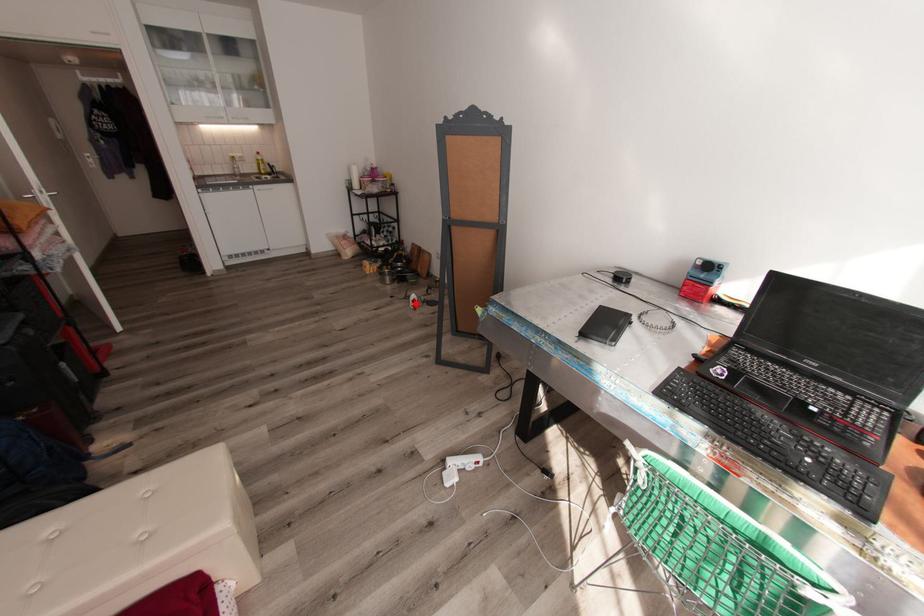
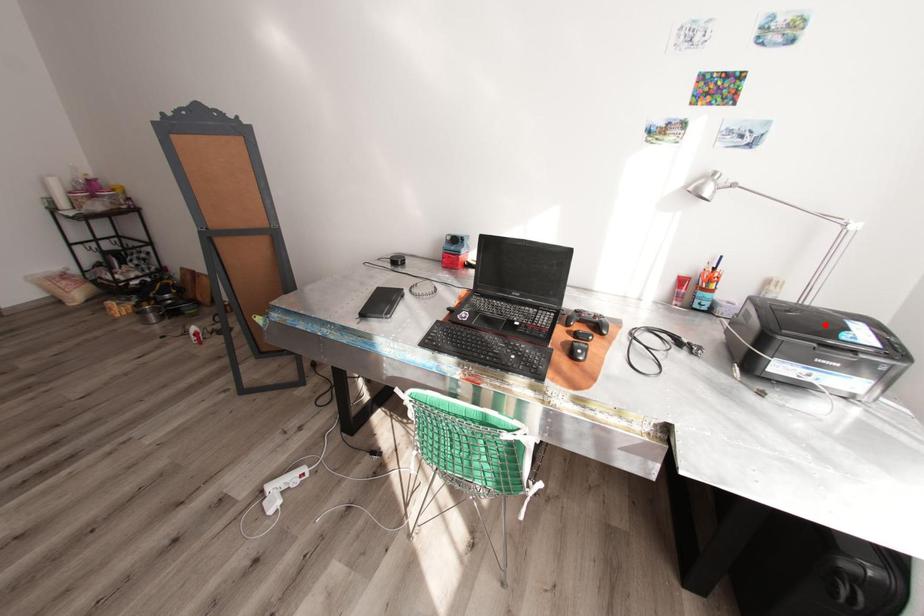
I am providing you with two images of the same scene from different viewpoints. A red point is marked on the first image and another point is marked on the second image. Do the highlighted points in image1 and image2 indicate the same real-world spot?

No